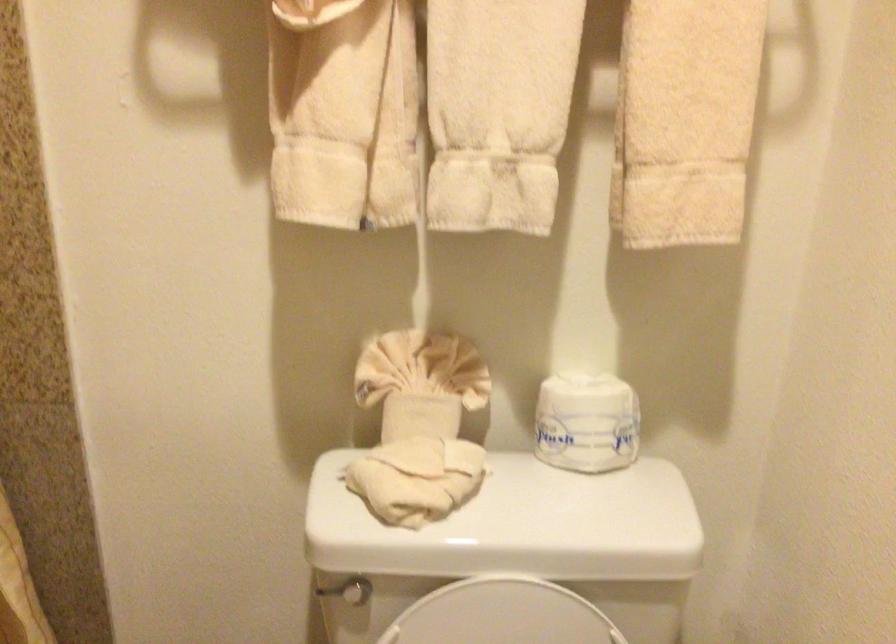
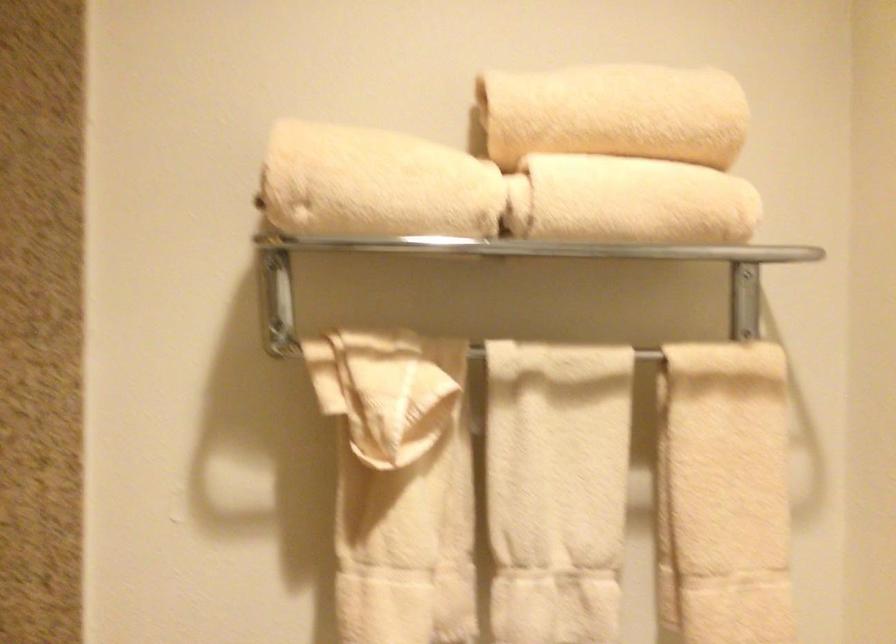
The images are taken continuously from a first-person perspective. In which direction are you moving?

The cameraman walked toward left, backward.